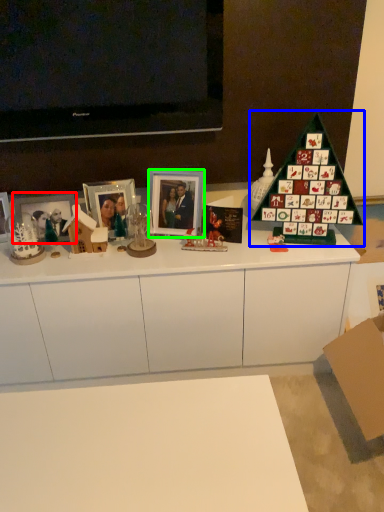
Question: Which is farther away from picture frame (highlighted by a red box)? christmas tree (highlighted by a blue box) or picture frame (highlighted by a green box)?

Choices:
 (A) christmas tree
 (B) picture frame

Answer: (A)